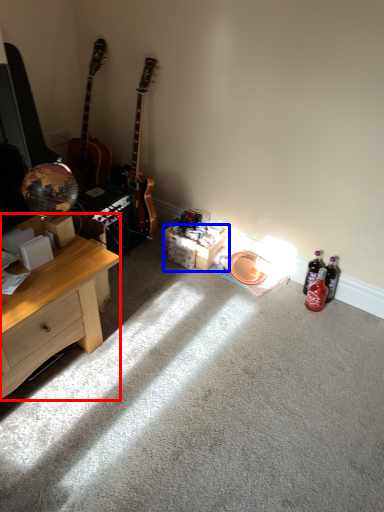
Question: Which of the following is the closest to the observer, desk (highlighted by a red box) or box (highlighted by a blue box)?

Choices:
 (A) desk
 (B) box

Answer: (A)